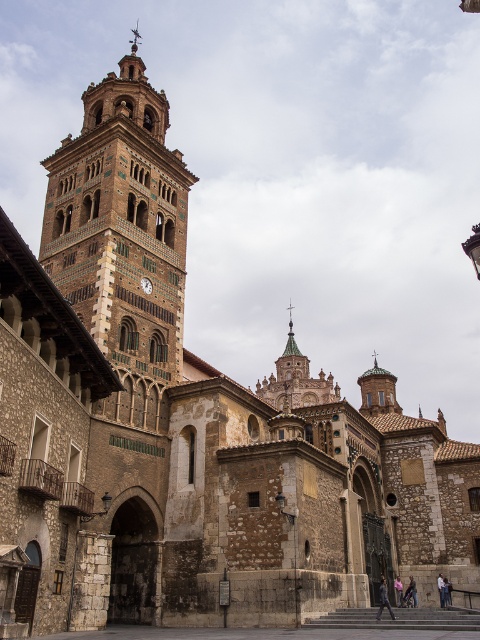
Question: Which point is farther from the camera taking this photo?

Choices:
 (A) (297, 364)
 (B) (119, 138)

Answer: (A)

Question: Observing the image, what is the correct spatial positioning of terracotta brick tower at left in reference to matte brown clock at upper left?

Choices:
 (A) left
 (B) right

Answer: (A)

Question: Is terracotta brick tower at left thinner than golden ornate spire at center?

Choices:
 (A) yes
 (B) no

Answer: (A)

Question: Estimate the real-world distances between objects in this image. Which object is farther from the golden ornate spire at center?

Choices:
 (A) terracotta brick tower at left
 (B) matte brown clock at upper left

Answer: (B)

Question: Which point is closer to the camera?

Choices:
 (A) matte brown clock at upper left
 (B) golden ornate spire at center
 (C) terracotta brick tower at left

Answer: (C)

Question: Is terracotta brick tower at left further to camera compared to golden ornate spire at center?

Choices:
 (A) yes
 (B) no

Answer: (B)